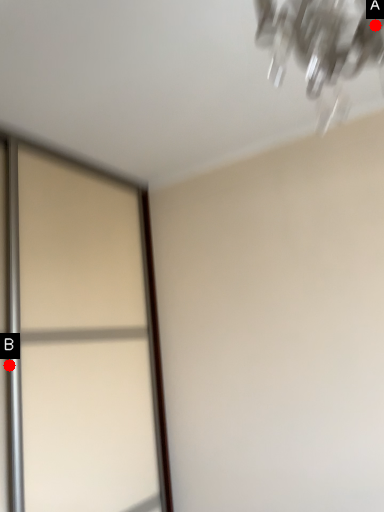
Question: Two points are circled on the image, labeled by A and B beside each circle. Which of the following is the farthest from the observer?

Choices:
 (A) A is further
 (B) B is further

Answer: (B)